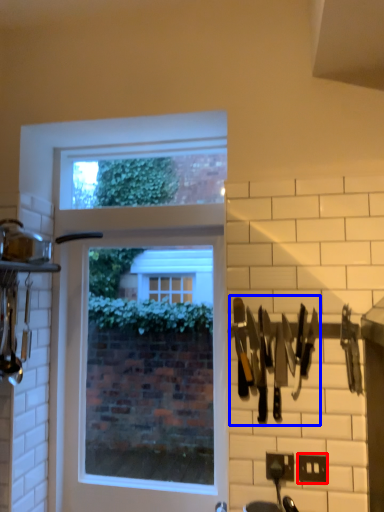
Question: Among these objects, which one is farthest to the camera, electric outlet (highlighted by a red box) or cutlery (highlighted by a blue box)?

Choices:
 (A) electric outlet
 (B) cutlery

Answer: (A)